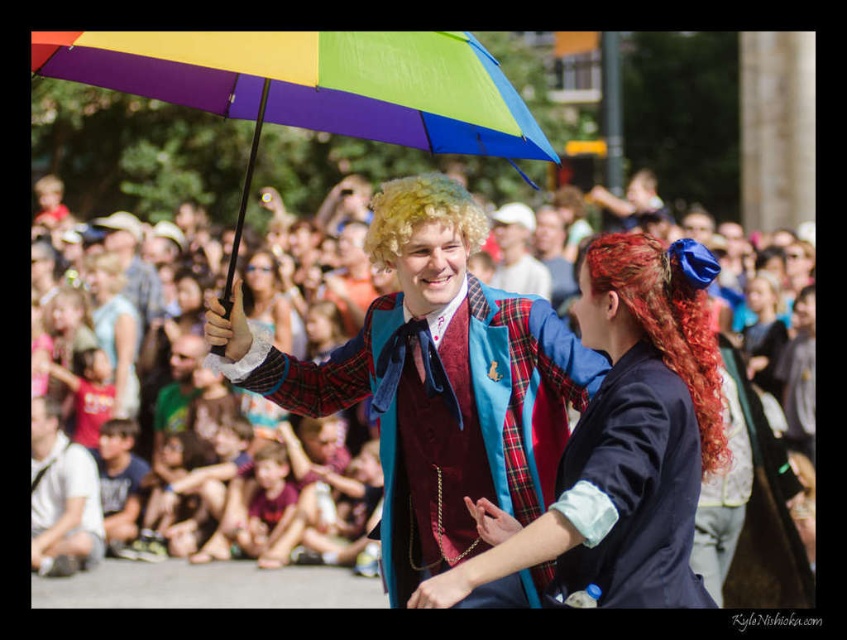
You are a photographer positioned at the back of the crowd, trying to capture both the curly red hair at center and the curly blonde wig at center in your shot. Which of the two will appear larger in your photo?

The curly red hair at center will appear larger in the photo because it is closer to the viewer than the curly blonde wig at center.

You are a photographer at the event and want to ensure both the curly red hair at center and the curly blonde wig at center are clearly visible in your photo. Given their sizes, which one might require more space in the frame to capture fully?

The curly red hair at center is bigger than the curly blonde wig at center, so it would require more space in the frame to ensure it is fully captured.

You are a photographer standing at the edge of the parade route. You want to capture both the matte white shirt at lower left and the curly blonde wig at center in the same frame. Your camera has a maximum zoom range that can cover 20 meters. Can you fit both subjects into the frame without moving closer?

The distance between the matte white shirt at lower left and the curly blonde wig at center is 23.13 meters, which exceeds the camera maximum zoom range of 20 meters. Therefore, you cannot fit both subjects into the frame without moving closer.